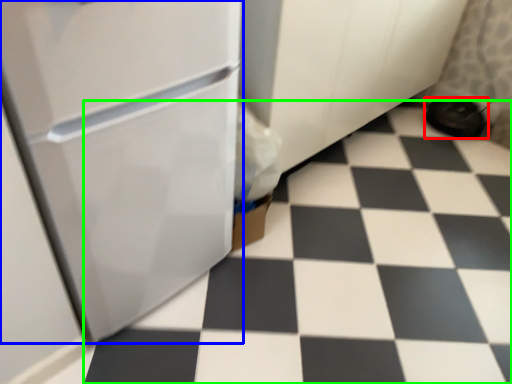
Question: Which object is the closest to the footwear (highlighted by a red box)? Choose among these: refrigerator (highlighted by a blue box) or tile (highlighted by a green box).

Choices:
 (A) refrigerator
 (B) tile

Answer: (B)